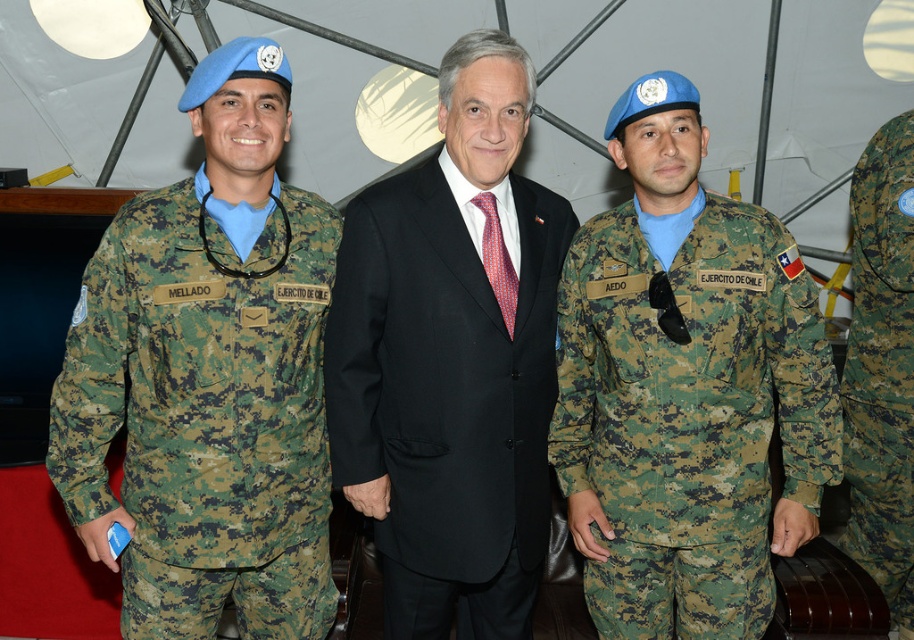
Question: Does camouflage fabric uniform at left appear over camouflage fabric uniform at center?

Choices:
 (A) no
 (B) yes

Answer: (B)

Question: Does camouflage fabric uniform at center have a smaller size compared to camouflagetextured fabric at right?

Choices:
 (A) no
 (B) yes

Answer: (B)

Question: Is camouflage fabric uniform at center below camouflagetextured fabric at right?

Choices:
 (A) yes
 (B) no

Answer: (B)

Question: Which object is the closest to the camouflage fabric uniform at left?

Choices:
 (A) black matte suit at center
 (B) camouflagetextured fabric at right
 (C) camouflage fabric uniform at center

Answer: (A)

Question: Which of the following is the closest to the observer?

Choices:
 (A) black matte suit at center
 (B) camouflage fabric uniform at center
 (C) camouflage fabric uniform at left
 (D) camouflagetextured fabric at right

Answer: (C)

Question: Which point is farther to the camera?

Choices:
 (A) (869, 276)
 (B) (266, 394)
 (C) (681, 612)
 (D) (473, 417)

Answer: (A)